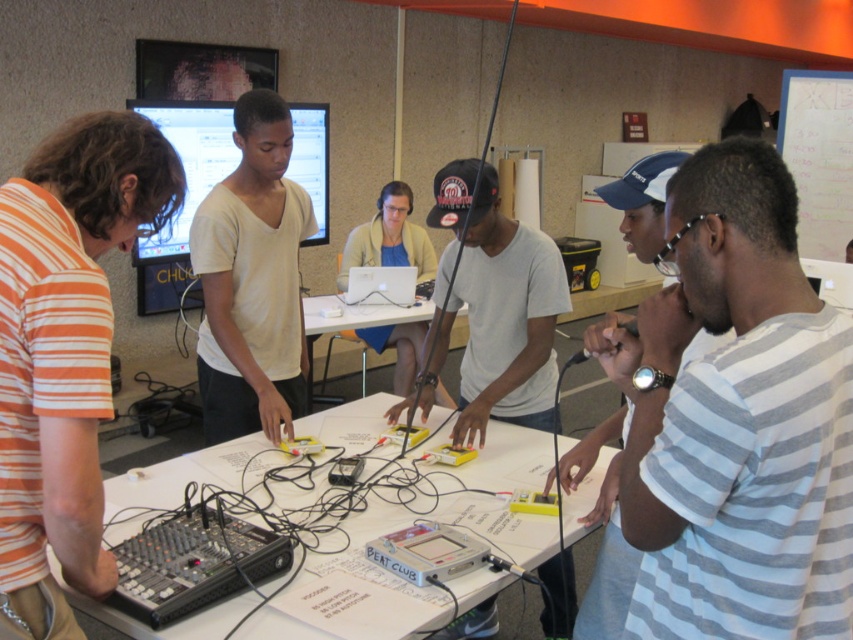
You are a photographer positioned at the camera location. You want to take a closeup of the point at location point (91,493) and point (544,452). Which point will appear larger in your photo?

Point (91,493) is closer to the camera than point (544,452), so it will appear larger in the photo.

You are organizing a music workshop and need to arrange seating based on the participants clothing. You have two participants wearing the orange striped shirt at left and the white matte shirt at center. Which participant should sit closer to the smaller table if the table size matches the participant size?

The orange striped shirt at left should sit closer to the smaller table because the orange striped shirt at left is smaller than the white matte shirt at center.